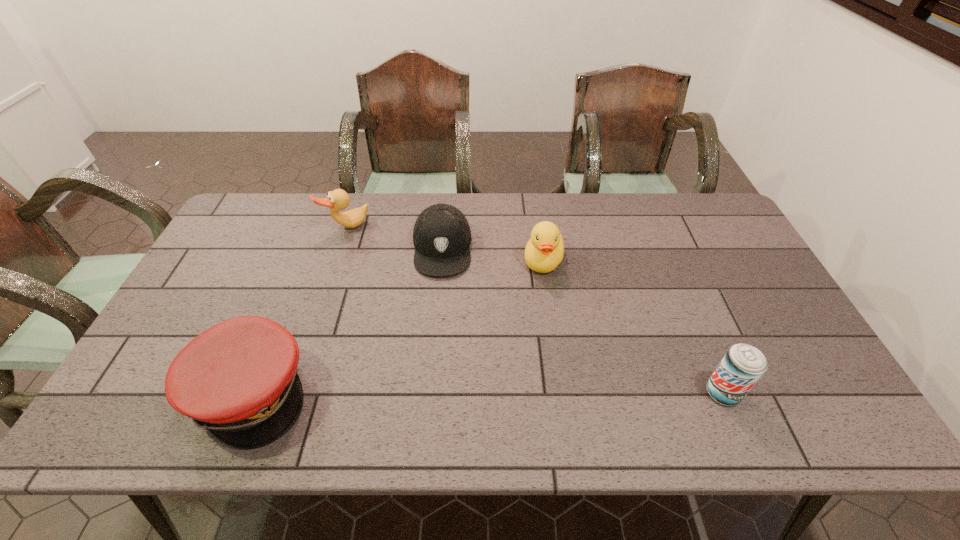
I want to click on cap present at the near edge, so click(238, 379).

Locate an element on the screen. beer can positioned at the near edge is located at coordinates (743, 365).

The height and width of the screenshot is (540, 960). Identify the location of object at the left edge. (x=238, y=379).

Find the location of a particular element. The image size is (960, 540). object positioned at the near left corner is located at coordinates (238, 379).

Where is `free location at the far edge`? The height and width of the screenshot is (540, 960). free location at the far edge is located at coordinates (468, 214).

Identify the location of vacant space at the near edge of the desktop. coord(527,378).

Locate an element on the screen. This screenshot has height=540, width=960. vacant space at the left edge of the desktop is located at coordinates (220, 244).

At what (x,y) coordinates should I click in order to perform the action: click on vacant space at the right edge. Please return your answer as a coordinate pair (x, y). Looking at the image, I should click on (735, 312).

At what (x,y) coordinates should I click in order to perform the action: click on vacant space at the far left corner of the desktop. Please return your answer as a coordinate pair (x, y). This screenshot has width=960, height=540. Looking at the image, I should click on (246, 224).

The image size is (960, 540). In order to click on vacant region at the far right corner of the desktop in this screenshot , I will do `click(680, 225)`.